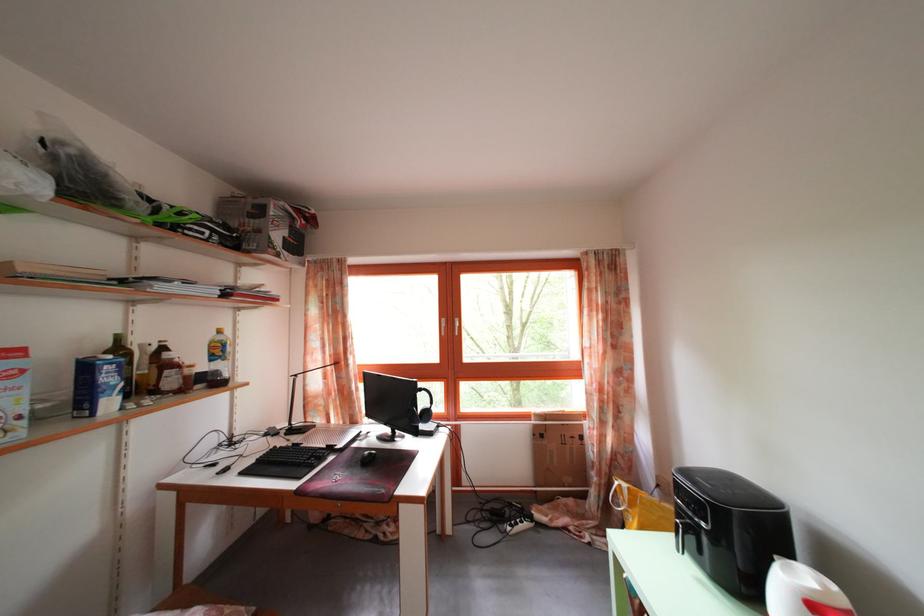
This screenshot has height=616, width=924. I want to click on air fryer handle, so click(x=730, y=528).